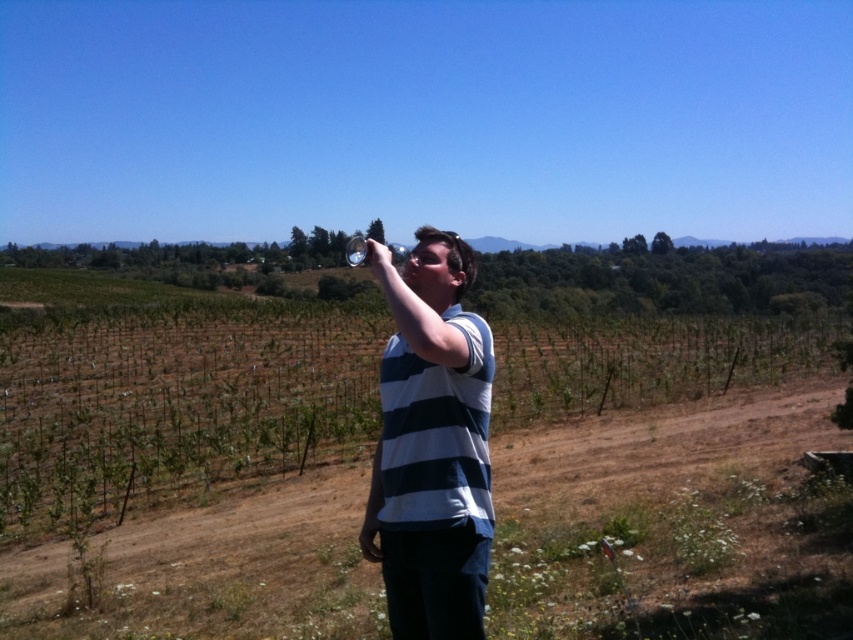
You are a photographer trying to capture the entire scene in one shot. The white striped shirt at center and the clear glass at upper center are both in your frame. Which object should you focus on first if you want to ensure both are in focus?

The clear glass at upper center is taller than the white striped shirt at center, so focusing on the clear glass at upper center will help ensure both are in focus.

Based on the coordinates provided in the scene, where is the white striped shirt at center located?

The white striped shirt at center is located at the coordinates point [432,445].